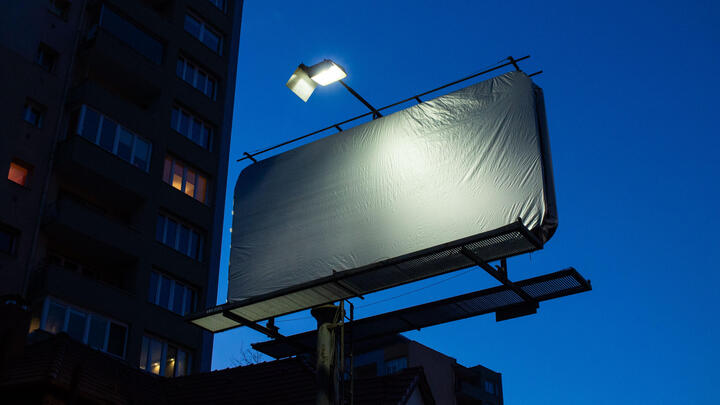
Where is `rack`? rack is located at coordinates (364, 114).